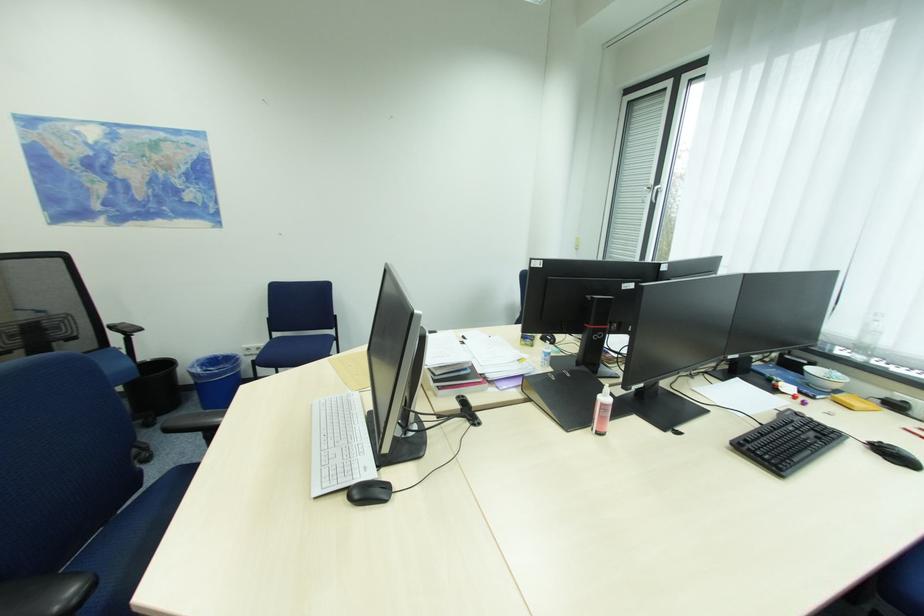
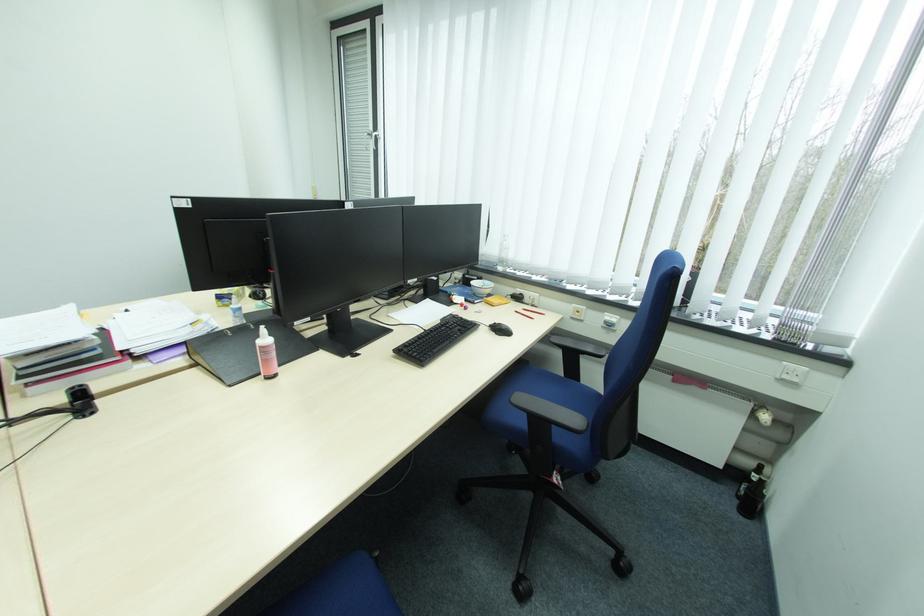
Question: Based on the continuous images, in which direction is the camera rotating? Reply with the corresponding letter.

Choices:
 (A) Left
 (B) Right
 (C) Up
 (D) Down

Answer: (B)